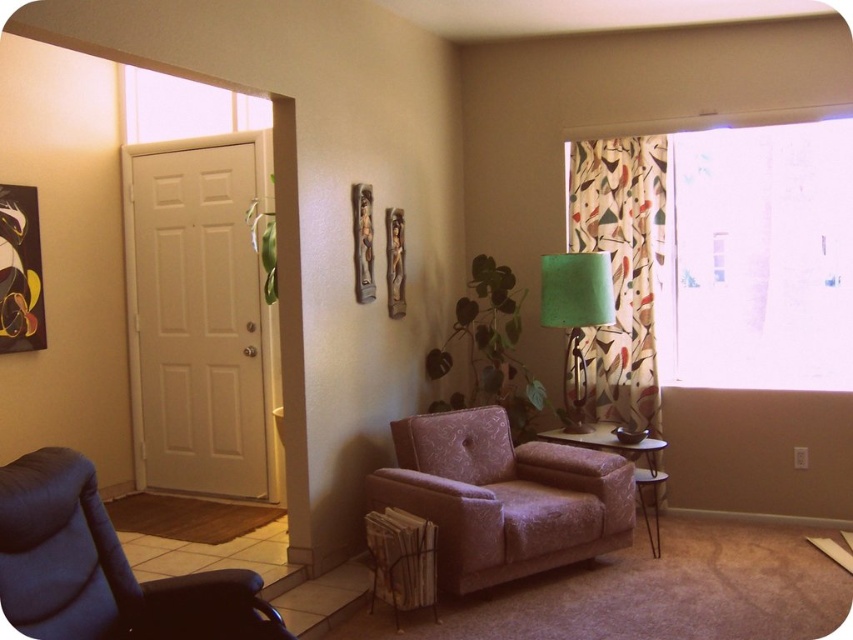
Between pink textured couch at center and patterned fabric curtain at right, which one appears on the right side from the viewer's perspective?

patterned fabric curtain at right is more to the right.

Does pink textured couch at center appear over patterned fabric curtain at right?

No.

What are the coordinates of `pink textured couch at center` in the screenshot? It's located at (503, 497).

Who is positioned more to the right, pink textured couch at center or velvet pink armchair at center?

Positioned to the right is velvet pink armchair at center.

Is pink textured couch at center above velvet pink armchair at center?

Correct, pink textured couch at center is located above velvet pink armchair at center.

Identify the location of pink textured couch at center. (503, 497).

In the scene shown: Does green fabric lampshade at upper right appear on the right side of velvet pink armchair at center?

No, green fabric lampshade at upper right is not to the right of velvet pink armchair at center.

Where is `green fabric lampshade at upper right`? The width and height of the screenshot is (853, 640). green fabric lampshade at upper right is located at coordinates tap(575, 314).